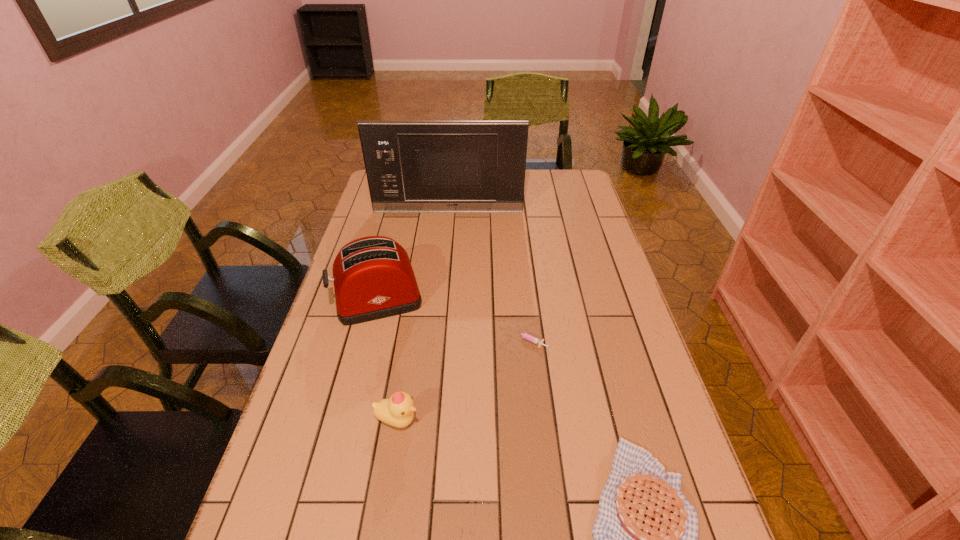
The width and height of the screenshot is (960, 540). I want to click on vacant space located on the front-facing side of the fourth farthest object, so click(x=590, y=421).

The image size is (960, 540). I want to click on free spot located on the right of the shortest object, so click(573, 340).

This screenshot has height=540, width=960. I want to click on microwave oven located at the left edge, so click(x=412, y=166).

This screenshot has width=960, height=540. What are the coordinates of `toaster located at the left edge` in the screenshot? It's located at (373, 278).

In the image, there is a desktop. Find the location of `vacant space at the far edge`. vacant space at the far edge is located at coordinates (535, 171).

Where is `vacant area at the left edge`? The height and width of the screenshot is (540, 960). vacant area at the left edge is located at coordinates (x=333, y=456).

Locate an element on the screen. vacant area at the right edge of the desktop is located at coordinates (605, 234).

In the image, there is a desktop. Identify the location of free space at the far right corner. (560, 191).

Identify the location of free space that is in between the shortest object and the tallest object. (488, 276).

You are a GUI agent. You are given a task and a screenshot of the screen. Output one action in this format:
    pyautogui.click(x=<x>, y=<y>)
    Task: Click on the vacant area that lies between the syringe and the toaster
    Image resolution: width=960 pixels, height=540 pixels.
    Given the screenshot: What is the action you would take?
    pyautogui.click(x=453, y=320)